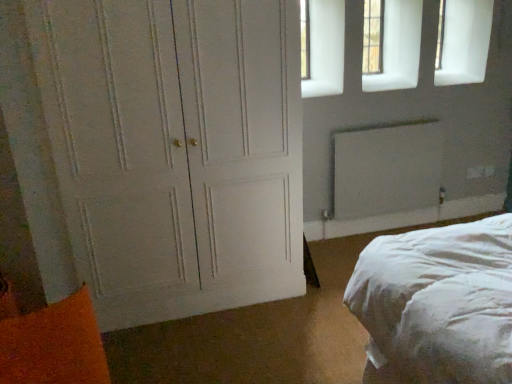
Image resolution: width=512 pixels, height=384 pixels. Describe the element at coordinates (373, 37) in the screenshot. I see `clear glass window at upper right` at that location.

I want to click on orange fuzzy pillow at lower left, so click(54, 345).

Image resolution: width=512 pixels, height=384 pixels. I want to click on white painted wood door at left, so click(178, 151).

What do you see at coordinates (178, 151) in the screenshot? I see `white painted wood door at left` at bounding box center [178, 151].

This screenshot has height=384, width=512. I want to click on white matte radiator at upper right, so click(387, 169).

Identify the location of clear glass window at upper right. This screenshot has width=512, height=384. (373, 37).

From the image's perspective, is white matte radiator at upper right located beneath orange fuzzy pillow at lower left?

Actually, white matte radiator at upper right appears above orange fuzzy pillow at lower left in the image.

From a real-world perspective, is white matte radiator at upper right physically below orange fuzzy pillow at lower left?

No, from a real-world perspective, white matte radiator at upper right is not under orange fuzzy pillow at lower left.

Is white matte radiator at upper right positioned behind orange fuzzy pillow at lower left?

Yes, white matte radiator at upper right is further from the camera.

Consider the image. Does white matte radiator at upper right appear on the right side of orange fuzzy pillow at lower left?

Correct, you'll find white matte radiator at upper right to the right of orange fuzzy pillow at lower left.

How distant is clear glass window at upper right from white matte radiator at upper right?

clear glass window at upper right and white matte radiator at upper right are 30.38 inches apart.

Is clear glass window at upper right to the right of white matte radiator at upper right from the viewer's perspective?

No.

Considering the points (379, 32) and (409, 201), which point is behind, point (379, 32) or point (409, 201)?

Point (379, 32)

In the scene shown: From the image's perspective, between clear glass window at upper right and white matte radiator at upper right, who is located below?

white matte radiator at upper right, from the image's perspective.

Considering the relative positions of orange fuzzy pillow at lower left and white painted wood door at left in the image provided, is orange fuzzy pillow at lower left to the left or to the right of white painted wood door at left?

orange fuzzy pillow at lower left is positioned on white painted wood door at left's left side.

Is orange fuzzy pillow at lower left taller or shorter than white painted wood door at left?

orange fuzzy pillow at lower left is shorter than white painted wood door at left.

From the image's perspective, between orange fuzzy pillow at lower left and white painted wood door at left, who is located below?

orange fuzzy pillow at lower left is shown below in the image.

The height and width of the screenshot is (384, 512). Find the location of `window above the white painted wood door at left (from the image's perspective)`. window above the white painted wood door at left (from the image's perspective) is located at coordinates (373, 37).

Is white painted wood door at left wider than clear glass window at upper right?

Indeed, white painted wood door at left has a greater width compared to clear glass window at upper right.

From a real-world perspective, between white painted wood door at left and clear glass window at upper right, who is vertically lower?

From a 3D spatial view, white painted wood door at left is below.

What's the angular difference between white painted wood door at left and clear glass window at upper right's facing directions?

white painted wood door at left and clear glass window at upper right are facing 0.804 degrees away from each other.

Which object is positioned more to the left, orange fuzzy pillow at lower left or white matte radiator at upper right?

orange fuzzy pillow at lower left.

From the image's perspective, is orange fuzzy pillow at lower left located beneath white matte radiator at upper right?

Yes, from the image's perspective, orange fuzzy pillow at lower left is below white matte radiator at upper right.

Is orange fuzzy pillow at lower left directly adjacent to white matte radiator at upper right?

No, orange fuzzy pillow at lower left is not in contact with white matte radiator at upper right.

Is orange fuzzy pillow at lower left not inside white matte radiator at upper right?

orange fuzzy pillow at lower left lies outside white matte radiator at upper right's area.

Locate an element on the screen. This screenshot has width=512, height=384. pillow in front of the white painted wood door at left is located at coordinates (54, 345).

Which is closer, [286,234] or [19,368]?

Point [286,234] is positioned farther from the camera compared to point [19,368].

Between white painted wood door at left and orange fuzzy pillow at lower left, which one has larger width?

white painted wood door at left.

Does white painted wood door at left lie behind orange fuzzy pillow at lower left?

Yes.

Between point (367, 9) and point (128, 305), which one is positioned behind?

The point (367, 9) is more distant.

Considering the relative sizes of clear glass window at upper right and white painted wood door at left in the image provided, is clear glass window at upper right smaller than white painted wood door at left?

Indeed, clear glass window at upper right has a smaller size compared to white painted wood door at left.

In the image, is clear glass window at upper right positioned in front of or behind white painted wood door at left?

Visually, clear glass window at upper right is located behind white painted wood door at left.

What's the angular difference between clear glass window at upper right and white painted wood door at left's facing directions?

The facing directions of clear glass window at upper right and white painted wood door at left are 0.804 degrees apart.

You are a GUI agent. You are given a task and a screenshot of the screen. Output one action in this format:
    pyautogui.click(x=<x>, y=<y>)
    Task: Click on the radiator located on the right of orange fuzzy pillow at lower left
    Image resolution: width=512 pixels, height=384 pixels.
    Given the screenshot: What is the action you would take?
    pyautogui.click(x=387, y=169)

I want to click on window behind the white matte radiator at upper right, so click(373, 37).

When comparing their distances from white painted wood door at left, does clear glass window at upper right or orange fuzzy pillow at lower left seem closer?

Among the two, orange fuzzy pillow at lower left is located nearer to white painted wood door at left.

Estimate the real-world distances between objects in this image. Which object is closer to clear glass window at upper right, orange fuzzy pillow at lower left or white painted wood door at left?

white painted wood door at left lies closer to clear glass window at upper right than the other object.

Based on their spatial positions, is clear glass window at upper right or white painted wood door at left further from white matte radiator at upper right?

white painted wood door at left lies further to white matte radiator at upper right than the other object.

Which object lies nearer to the anchor point white matte radiator at upper right, orange fuzzy pillow at lower left or white painted wood door at left?

white painted wood door at left.

Estimate the real-world distances between objects in this image. Which object is closer to orange fuzzy pillow at lower left, white painted wood door at left or white matte radiator at upper right?

Among the two, white painted wood door at left is located nearer to orange fuzzy pillow at lower left.

From the picture: When comparing their distances from clear glass window at upper right, does white painted wood door at left or white matte radiator at upper right seem closer?

white matte radiator at upper right is positioned closer to the anchor clear glass window at upper right.

Estimate the real-world distances between objects in this image. Which object is further from white painted wood door at left, clear glass window at upper right or white matte radiator at upper right?

Based on the image, clear glass window at upper right appears to be further to white painted wood door at left.

From the picture: Estimate the real-world distances between objects in this image. Which object is further from orange fuzzy pillow at lower left, white matte radiator at upper right or clear glass window at upper right?

clear glass window at upper right is positioned further to the anchor orange fuzzy pillow at lower left.

Find the location of a particular element. This screenshot has height=384, width=512. window between white painted wood door at left and white matte radiator at upper right from left to right is located at coordinates (373, 37).

Where is `door between orange fuzzy pillow at lower left and clear glass window at upper right along the z-axis`? This screenshot has height=384, width=512. door between orange fuzzy pillow at lower left and clear glass window at upper right along the z-axis is located at coordinates (178, 151).

The image size is (512, 384). Find the location of `door between orange fuzzy pillow at lower left and white matte radiator at upper right from front to back`. door between orange fuzzy pillow at lower left and white matte radiator at upper right from front to back is located at coordinates (178, 151).

You are a GUI agent. You are given a task and a screenshot of the screen. Output one action in this format:
    pyautogui.click(x=<x>, y=<y>)
    Task: Click on the radiator between orange fuzzy pillow at lower left and clear glass window at upper right in the front-back direction
    This screenshot has height=384, width=512.
    Given the screenshot: What is the action you would take?
    pyautogui.click(x=387, y=169)